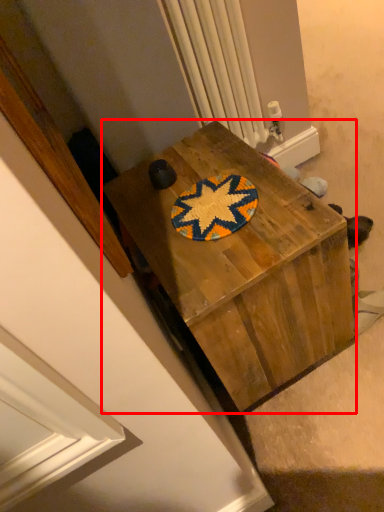
Question: From the image's perspective, what is the correct spatial relationship of desk (annotated by the red box) in relation to radiator?

Choices:
 (A) above
 (B) below

Answer: (B)